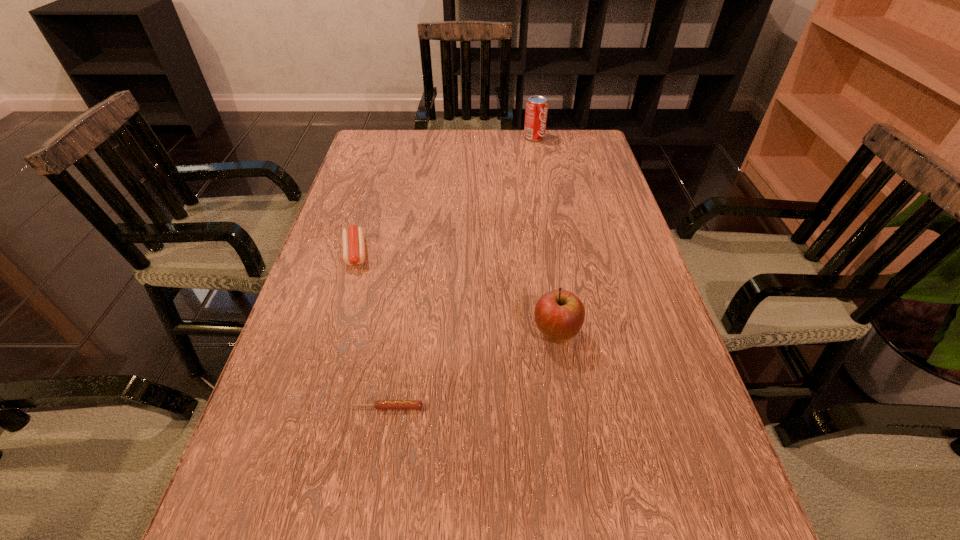
The height and width of the screenshot is (540, 960). Identify the location of vacant space that is in between the farthest object and the nearer sausage. (461, 272).

Find the location of a particular element. This screenshot has width=960, height=540. free space that is in between the farthest object and the shorter sausage is located at coordinates (461, 272).

Image resolution: width=960 pixels, height=540 pixels. Identify the location of empty space that is in between the third nearest object and the third farthest object. (456, 293).

Identify the location of unoccupied area between the shorter sausage and the farthest object. (461, 272).

Where is `free area in between the farthest object and the second nearest object`? Image resolution: width=960 pixels, height=540 pixels. free area in between the farthest object and the second nearest object is located at coordinates (545, 235).

Image resolution: width=960 pixels, height=540 pixels. I want to click on free space between the third object from right to left and the apple, so click(471, 370).

The width and height of the screenshot is (960, 540). In order to click on free space between the farther sausage and the farthest object in this screenshot , I will do `click(444, 195)`.

Point out which object is positioned as the nearest to the second nearest object. Please provide its 2D coordinates. Your answer should be formatted as a tuple, i.e. [(x, y)], where the tuple contains the x and y coordinates of a point satisfying the conditions above.

[(380, 404)]

You are a GUI agent. You are given a task and a screenshot of the screen. Output one action in this format:
    pyautogui.click(x=<x>, y=<y>)
    Task: Click on the object that stands as the third closest to the second nearest object
    The width and height of the screenshot is (960, 540).
    Given the screenshot: What is the action you would take?
    pyautogui.click(x=536, y=112)

Where is `vacant space that satisfies the following two spatial constraints: 1. on the back side of the soda can; 2. on the left side of the taller sausage`? Image resolution: width=960 pixels, height=540 pixels. vacant space that satisfies the following two spatial constraints: 1. on the back side of the soda can; 2. on the left side of the taller sausage is located at coordinates (390, 137).